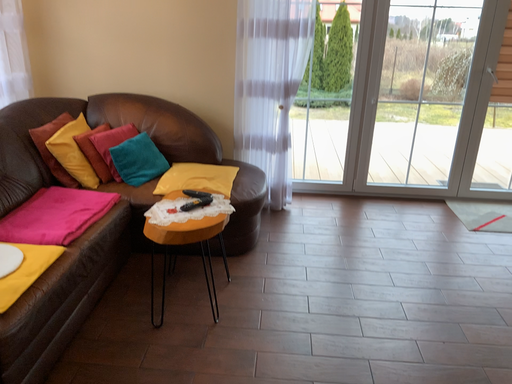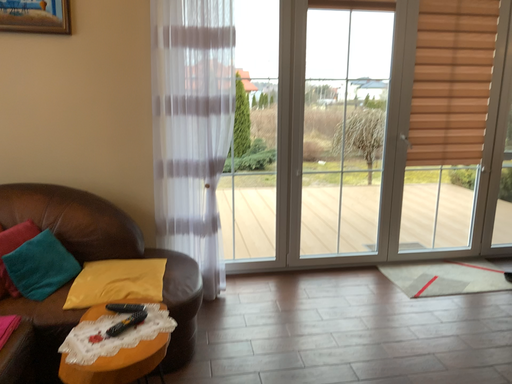
Question: Which way did the camera rotate in the video?

Choices:
 (A) rotated left
 (B) rotated right

Answer: (B)